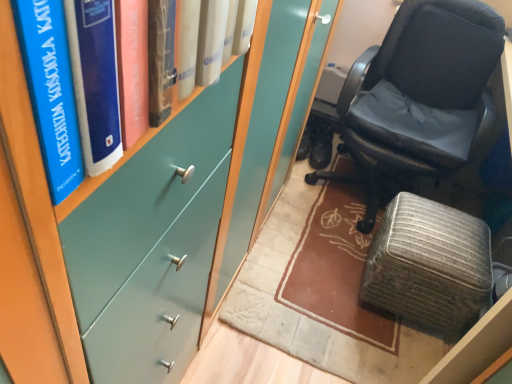
What do you see at coordinates (429, 265) in the screenshot?
I see `textured gray ottoman at lower right` at bounding box center [429, 265].

Describe the element at coordinates (19, 127) in the screenshot. I see `teal matte bookshelf at upper left` at that location.

Identify the location of teal matte bookshelf at upper left. This screenshot has height=384, width=512. (19, 127).

Locate an element on the screen. The image size is (512, 384). black leather shoes at center is located at coordinates (321, 145).

Does textured gray ottoman at lower right have a lesser width compared to black leather chair at right?

Yes, textured gray ottoman at lower right is thinner than black leather chair at right.

This screenshot has width=512, height=384. Find the location of `chair above the textured gray ottoman at lower right (from the image's perspective)`. chair above the textured gray ottoman at lower right (from the image's perspective) is located at coordinates (422, 93).

Considering the relative sizes of textured gray ottoman at lower right and black leather chair at right in the image provided, is textured gray ottoman at lower right shorter than black leather chair at right?

Yes, textured gray ottoman at lower right is shorter than black leather chair at right.

How many degrees apart are the facing directions of textured gray ottoman at lower right and black leather chair at right?

Answer: textured gray ottoman at lower right and black leather chair at right are facing 5.98 degrees away from each other.

Which of these two, black leather chair at right or textured gray ottoman at lower right, stands taller?

Standing taller between the two is black leather chair at right.

From the image's perspective, would you say black leather chair at right is positioned over textured gray ottoman at lower right?

Yes, from the image's perspective, black leather chair at right is over textured gray ottoman at lower right.

Does point (397, 110) lie behind point (423, 244)?

Yes, point (397, 110) is behind point (423, 244).

Which object is positioned more to the left, black leather chair at right or textured gray ottoman at lower right?

From the viewer's perspective, textured gray ottoman at lower right appears more on the left side.

Considering the positions of objects black leather shoes at center and teal matte bookshelf at upper left in the image provided, who is behind, black leather shoes at center or teal matte bookshelf at upper left?

Result: Positioned behind is black leather shoes at center.

At what (x,y) coordinates should I click in order to perform the action: click on footwear behind the teal matte bookshelf at upper left. Please return your answer as a coordinate pair (x, y). Looking at the image, I should click on (321, 145).

Is black leather shoes at center not within teal matte bookshelf at upper left?

Yes, black leather shoes at center is outside of teal matte bookshelf at upper left.

Is teal matte bookshelf at upper left shorter than textured gray ottoman at lower right?

Indeed, teal matte bookshelf at upper left has a lesser height compared to textured gray ottoman at lower right.

Identify the location of furniture that appears below the teal matte bookshelf at upper left (from a real-world perspective). The width and height of the screenshot is (512, 384). (429, 265).

Is teal matte bookshelf at upper left looking in the opposite direction of textured gray ottoman at lower right?

No, teal matte bookshelf at upper left is not facing the opposite direction of textured gray ottoman at lower right.

From the image's perspective, is teal matte bookshelf at upper left below textured gray ottoman at lower right?

Incorrect, from the image's perspective, teal matte bookshelf at upper left is higher than textured gray ottoman at lower right.

Looking at this image, from a real-world perspective, is textured gray ottoman at lower right over teal matte bookshelf at upper left?

Incorrect, from a real-world perspective, textured gray ottoman at lower right is lower than teal matte bookshelf at upper left.

Is textured gray ottoman at lower right to the right of teal matte bookshelf at upper left from the viewer's perspective?

Yes, textured gray ottoman at lower right is to the right of teal matte bookshelf at upper left.

Measure the distance between textured gray ottoman at lower right and teal matte bookshelf at upper left.

textured gray ottoman at lower right is 1.23 meters away from teal matte bookshelf at upper left.

Is teal matte bookshelf at upper left located within textured gray ottoman at lower right?

No, teal matte bookshelf at upper left is located outside of textured gray ottoman at lower right.

Which is closer, (323,135) or (446,164)?

Positioned in front is point (446,164).

Is black leather shoes at center bigger than black leather chair at right?

No.

Is black leather chair at right at the back of black leather shoes at center?

Yes, black leather shoes at center's orientation is away from black leather chair at right.

Could you tell me if black leather chair at right is facing teal matte bookshelf at upper left?

Yes, black leather chair at right is oriented towards teal matte bookshelf at upper left.

Locate an element on the screen. chair to the right of teal matte bookshelf at upper left is located at coordinates (422, 93).

In the image, is black leather chair at right positioned in front of or behind teal matte bookshelf at upper left?

In the image, black leather chair at right appears behind teal matte bookshelf at upper left.

From the image's perspective, is black leather chair at right above teal matte bookshelf at upper left?

Yes, from the image's perspective, black leather chair at right is over teal matte bookshelf at upper left.

Find the location of a particular element. furniture that is behind the black leather chair at right is located at coordinates (429, 265).

Identify the location of furniture that is below the black leather chair at right (from the image's perspective). This screenshot has height=384, width=512. (429, 265).

Considering their positions, is black leather chair at right positioned further to black leather shoes at center than textured gray ottoman at lower right?

Among the two, textured gray ottoman at lower right is located further to black leather shoes at center.

From the image, which object appears to be nearer to teal matte bookshelf at upper left, black leather shoes at center or textured gray ottoman at lower right?

textured gray ottoman at lower right lies closer to teal matte bookshelf at upper left than the other object.

Looking at the image, which one is located further to black leather shoes at center, textured gray ottoman at lower right or teal matte bookshelf at upper left?

The object further to black leather shoes at center is teal matte bookshelf at upper left.

Considering their positions, is black leather chair at right positioned closer to textured gray ottoman at lower right than teal matte bookshelf at upper left?

black leather chair at right.

Considering their positions, is black leather chair at right positioned closer to teal matte bookshelf at upper left than black leather shoes at center?

black leather chair at right lies closer to teal matte bookshelf at upper left than the other object.

Considering their positions, is black leather chair at right positioned further to black leather shoes at center than teal matte bookshelf at upper left?

Among the two, teal matte bookshelf at upper left is located further to black leather shoes at center.

Estimate the real-world distances between objects in this image. Which object is further from textured gray ottoman at lower right, black leather shoes at center or black leather chair at right?

The object further to textured gray ottoman at lower right is black leather shoes at center.

From the image, which object appears to be farther from black leather chair at right, black leather shoes at center or textured gray ottoman at lower right?

Among the two, black leather shoes at center is located further to black leather chair at right.

Find the location of a particular element. This screenshot has width=512, height=384. furniture between teal matte bookshelf at upper left and black leather shoes at center from front to back is located at coordinates (429, 265).

The height and width of the screenshot is (384, 512). I want to click on chair between teal matte bookshelf at upper left and textured gray ottoman at lower right from front to back, so click(x=422, y=93).

At what (x,y) coordinates should I click in order to perform the action: click on chair located between teal matte bookshelf at upper left and black leather shoes at center in the depth direction. Please return your answer as a coordinate pair (x, y). This screenshot has width=512, height=384. Looking at the image, I should click on (422, 93).

At what (x,y) coordinates should I click in order to perform the action: click on furniture between black leather chair at right and black leather shoes at center along the z-axis. Please return your answer as a coordinate pair (x, y). This screenshot has width=512, height=384. Looking at the image, I should click on (429, 265).